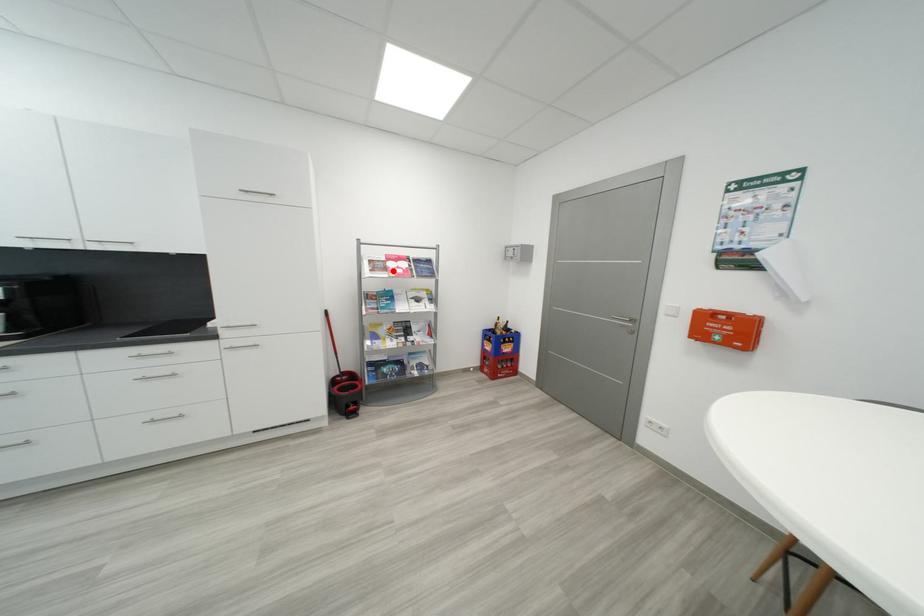
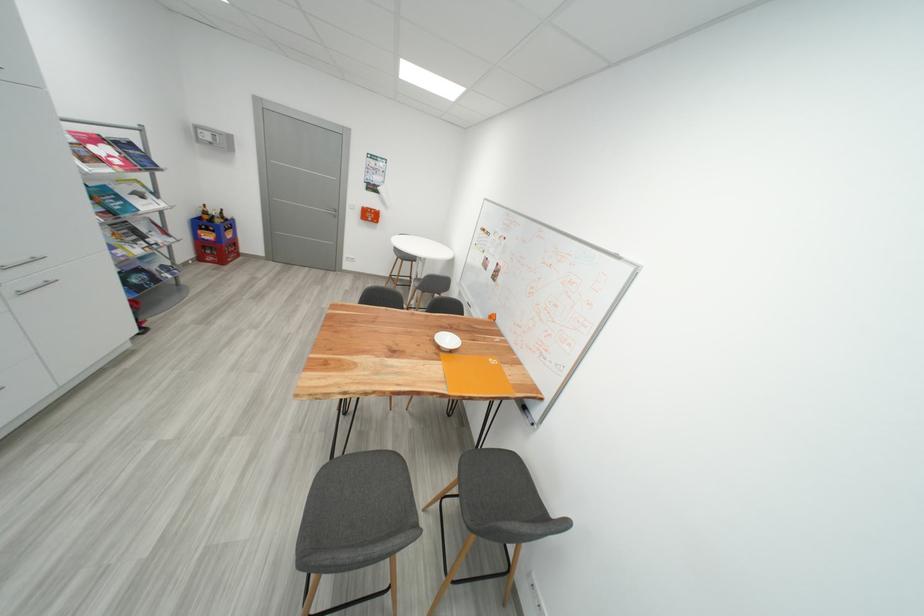
Locate, in the second image, the point that corresponds to the highlighted location in the first image.

(104, 161)